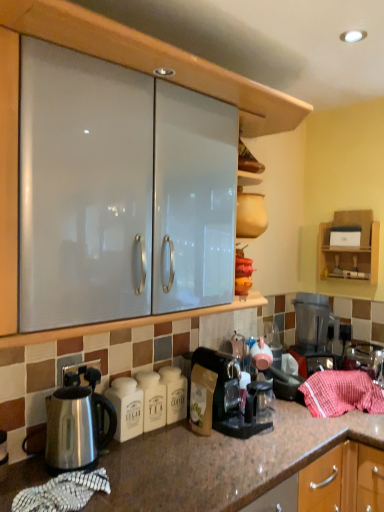
Image resolution: width=384 pixels, height=512 pixels. What do you see at coordinates (350, 247) in the screenshot?
I see `wooden shelf at upper right` at bounding box center [350, 247].

What do you see at coordinates (219, 395) in the screenshot? The width and height of the screenshot is (384, 512). I see `transparent plastic coffee maker at lower center, the 2th coffee maker from the right` at bounding box center [219, 395].

The width and height of the screenshot is (384, 512). What do you see at coordinates (77, 424) in the screenshot?
I see `stainless steel kettle at lower left` at bounding box center [77, 424].

At what (x,y) coordinates should I click in order to perform the action: click on black plastic coffee maker at right, the second coffee maker when ordered from front to back. Please return your answer as a coordinate pair (x, y). Looking at the image, I should click on (313, 330).

I want to click on white ceramic sugar container at lower left, so click(126, 407).

This screenshot has height=512, width=384. What do you see at coordinates (341, 393) in the screenshot?
I see `red striped cloth at lower right` at bounding box center [341, 393].

Locate an element on the screen. The height and width of the screenshot is (512, 384). wooden shelf at upper right is located at coordinates (350, 247).

In the scene shown: Would you say black plastic coffee maker at right, the second coffee maker when ordered from front to back, is outside stainless steel kettle at lower left?

black plastic coffee maker at right, the second coffee maker when ordered from front to back, is positioned outside stainless steel kettle at lower left.

In the scene shown: Is black plastic coffee maker at right, the 2th coffee maker viewed from the left, taller than stainless steel kettle at lower left?

Correct, black plastic coffee maker at right, the 2th coffee maker viewed from the left, is much taller as stainless steel kettle at lower left.

From the image's perspective, is black plastic coffee maker at right, the second coffee maker when ordered from front to back, located above or below stainless steel kettle at lower left?

black plastic coffee maker at right, the second coffee maker when ordered from front to back, is above stainless steel kettle at lower left.

Is black plastic coffee maker at right, the second coffee maker when ordered from front to back, looking in the opposite direction of stainless steel kettle at lower left?

That's not correct — black plastic coffee maker at right, the second coffee maker when ordered from front to back, is not looking away from stainless steel kettle at lower left.

At what (x,y) coordinates should I click in order to perform the action: click on blanket located below the wooden shelf at upper right (from the image's perspective). Please return your answer as a coordinate pair (x, y). The image size is (384, 512). Looking at the image, I should click on (341, 393).

From a real-world perspective, is red striped cloth at lower right below wooden shelf at upper right?

Yes, from a real-world perspective, red striped cloth at lower right is below wooden shelf at upper right.

From the image's perspective, is red striped cloth at lower right below wooden shelf at upper right?

Yes.

Considering the relative positions of red striped cloth at lower right and wooden shelf at upper right in the image provided, is red striped cloth at lower right to the right of wooden shelf at upper right from the viewer's perspective?

In fact, red striped cloth at lower right is to the left of wooden shelf at upper right.

From the image's perspective, starting from the white ceramic sugar container at lower left, which coffee maker is the 1st one above? Please provide its 2D coordinates.

[(219, 395)]

Considering the sizes of objects transparent plastic coffee maker at lower center, the first coffee maker from the front, and white ceramic sugar container at lower left in the image provided, who is taller, transparent plastic coffee maker at lower center, the first coffee maker from the front, or white ceramic sugar container at lower left?

transparent plastic coffee maker at lower center, the first coffee maker from the front, is taller.

Is transparent plastic coffee maker at lower center, which is the 1th coffee maker from left to right, positioned far away from white ceramic sugar container at lower left?

No, transparent plastic coffee maker at lower center, which is the 1th coffee maker from left to right, is not far from white ceramic sugar container at lower left.

Can you confirm if transparent plastic coffee maker at lower center, which is the 1th coffee maker from left to right, is positioned to the right of white ceramic sugar container at lower left?

Indeed, transparent plastic coffee maker at lower center, which is the 1th coffee maker from left to right, is positioned on the right side of white ceramic sugar container at lower left.

Is black plastic coffee maker at right, the second coffee maker when ordered from front to back, to the left or to the right of white ceramic sugar container at lower left in the image?

black plastic coffee maker at right, the second coffee maker when ordered from front to back, is to the right of white ceramic sugar container at lower left.

Considering the relative sizes of black plastic coffee maker at right, the second coffee maker when ordered from front to back, and white ceramic sugar container at lower left in the image provided, is black plastic coffee maker at right, the second coffee maker when ordered from front to back, smaller than white ceramic sugar container at lower left?

No, black plastic coffee maker at right, the second coffee maker when ordered from front to back, is not smaller than white ceramic sugar container at lower left.

Would you say black plastic coffee maker at right, the second coffee maker when ordered from front to back, is outside white ceramic sugar container at lower left?

black plastic coffee maker at right, the second coffee maker when ordered from front to back, is positioned outside white ceramic sugar container at lower left.

Is transparent plastic coffee maker at lower center, which is the 2th coffee maker in back-to-front order, beside stainless steel kettle at lower left?

They are not placed beside each other.

Is transparent plastic coffee maker at lower center, which is the 2th coffee maker in back-to-front order, at the right side of stainless steel kettle at lower left?

Correct, you'll find transparent plastic coffee maker at lower center, which is the 2th coffee maker in back-to-front order, to the right of stainless steel kettle at lower left.

From the picture: Can you confirm if transparent plastic coffee maker at lower center, the first coffee maker from the front, is thinner than stainless steel kettle at lower left?

No, transparent plastic coffee maker at lower center, the first coffee maker from the front, is not thinner than stainless steel kettle at lower left.

Looking at the image, does black plastic coffee maker at right, which is the first coffee maker in back-to-front order, seem bigger or smaller compared to transparent plastic coffee maker at lower center, the 2th coffee maker from the right?

Considering their sizes, black plastic coffee maker at right, which is the first coffee maker in back-to-front order, takes up more space than transparent plastic coffee maker at lower center, the 2th coffee maker from the right.

Looking at this image, between black plastic coffee maker at right, positioned as the first coffee maker in right-to-left order, and transparent plastic coffee maker at lower center, which is the 1th coffee maker from left to right, which one appears on the right side from the viewer's perspective?

Positioned to the right is black plastic coffee maker at right, positioned as the first coffee maker in right-to-left order.

Is point (306, 362) in front of point (201, 424)?

No, (306, 362) is behind (201, 424).

From a real-world perspective, is white ceramic sugar container at lower left physically located above or below red striped cloth at lower right?

white ceramic sugar container at lower left is above red striped cloth at lower right.

Is white ceramic sugar container at lower left turned away from red striped cloth at lower right?

white ceramic sugar container at lower left does not have its back to red striped cloth at lower right.

From the picture: In terms of width, does white ceramic sugar container at lower left look wider or thinner when compared to red striped cloth at lower right?

Result: In the image, white ceramic sugar container at lower left appears to be more narrow than red striped cloth at lower right.

At what (x,y) coordinates should I click in order to perform the action: click on the 2nd coffee maker to the right of the stainless steel kettle at lower left, starting your count from the anchor. Please return your answer as a coordinate pair (x, y). The image size is (384, 512). Looking at the image, I should click on (313, 330).

At what (x,y) coordinates should I click in order to perform the action: click on cabinetry located above the red striped cloth at lower right (from a real-world perspective). Please return your answer as a coordinate pair (x, y). This screenshot has width=384, height=512. Looking at the image, I should click on (350, 247).

Estimate the real-world distances between objects in this image. Which object is closer to red striped cloth at lower right, transparent plastic coffee maker at lower center, which is the 1th coffee maker from left to right, or white ceramic sugar container at lower left?

transparent plastic coffee maker at lower center, which is the 1th coffee maker from left to right.

Looking at the image, which one is located further to white ceramic sugar container at lower left, transparent plastic coffee maker at lower center, the first coffee maker from the front, or red striped cloth at lower right?

Among the two, red striped cloth at lower right is located further to white ceramic sugar container at lower left.

Considering their positions, is stainless steel kettle at lower left positioned further to transparent plastic coffee maker at lower center, the 2th coffee maker from the right, than black plastic coffee maker at right, the second coffee maker when ordered from front to back?

The object further to transparent plastic coffee maker at lower center, the 2th coffee maker from the right, is black plastic coffee maker at right, the second coffee maker when ordered from front to back.

Looking at the image, which one is located closer to red striped cloth at lower right, stainless steel kettle at lower left or transparent plastic coffee maker at lower center, the first coffee maker from the front?

transparent plastic coffee maker at lower center, the first coffee maker from the front.

Based on the photo, when comparing their distances from red striped cloth at lower right, does wooden shelf at upper right or black plastic coffee maker at right, the second coffee maker when ordered from front to back, seem closer?

black plastic coffee maker at right, the second coffee maker when ordered from front to back.

Which object lies nearer to the anchor point transparent plastic coffee maker at lower center, which is the 1th coffee maker from left to right, red striped cloth at lower right or wooden shelf at upper right?

red striped cloth at lower right.

Which object lies further to the anchor point transparent plastic coffee maker at lower center, which is the 1th coffee maker from left to right, white ceramic sugar container at lower left or black plastic coffee maker at right, which is the first coffee maker in back-to-front order?

black plastic coffee maker at right, which is the first coffee maker in back-to-front order, is further to transparent plastic coffee maker at lower center, which is the 1th coffee maker from left to right.

Which object lies further to the anchor point stainless steel kettle at lower left, transparent plastic coffee maker at lower center, which is the 2th coffee maker in back-to-front order, or white ceramic sugar container at lower left?

transparent plastic coffee maker at lower center, which is the 2th coffee maker in back-to-front order, is positioned further to the anchor stainless steel kettle at lower left.

This screenshot has width=384, height=512. In order to click on coffee maker between white ceramic sugar container at lower left and black plastic coffee maker at right, positioned as the first coffee maker in right-to-left order, from left to right in this screenshot , I will do `click(219, 395)`.

Identify the location of coffee maker between transparent plastic coffee maker at lower center, the 2th coffee maker from the right, and red striped cloth at lower right. The width and height of the screenshot is (384, 512). (313, 330).

The height and width of the screenshot is (512, 384). Identify the location of appliance between stainless steel kettle at lower left and black plastic coffee maker at right, the second coffee maker when ordered from front to back, in the horizontal direction. (126, 407).

The image size is (384, 512). Identify the location of appliance between stainless steel kettle at lower left and wooden shelf at upper right. (126, 407).